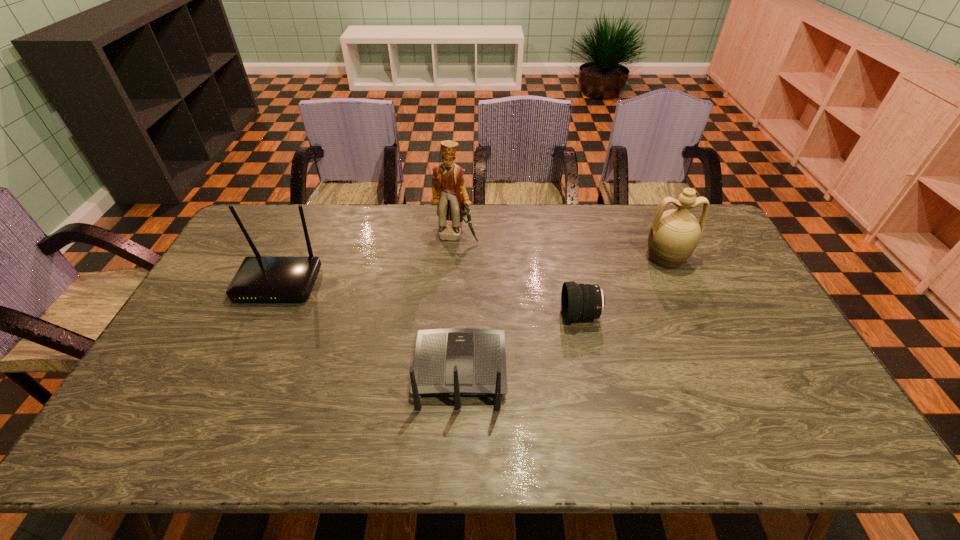
I want to click on object that is at the right edge, so click(674, 234).

Identify the location of object at the far right corner. (674, 234).

What are the coordinates of `vacant space at the far edge` in the screenshot? It's located at pos(546,232).

Identify the location of free region at the right edge of the desktop. The image size is (960, 540). pyautogui.click(x=698, y=249).

In the image, there is a desktop. Where is `vacant space at the near right corner`? The height and width of the screenshot is (540, 960). vacant space at the near right corner is located at coordinates (788, 453).

This screenshot has height=540, width=960. Identify the location of vacant space that's between the fourth object from left to right and the shorter router. (520, 343).

You are a GUI agent. You are given a task and a screenshot of the screen. Output one action in this format:
    pyautogui.click(x=<x>, y=<y>)
    Task: Click on the free area in between the taller router and the fourth tallest object
    
    Given the screenshot: What is the action you would take?
    pyautogui.click(x=370, y=327)

The height and width of the screenshot is (540, 960). In order to click on empty location between the nutcracker and the pitcher in this screenshot , I will do `click(561, 247)`.

Where is `vacant space that's between the nutcracker and the second shortest object`? The width and height of the screenshot is (960, 540). vacant space that's between the nutcracker and the second shortest object is located at coordinates (458, 303).

I want to click on vacant point located between the pitcher and the tallest object, so click(561, 247).